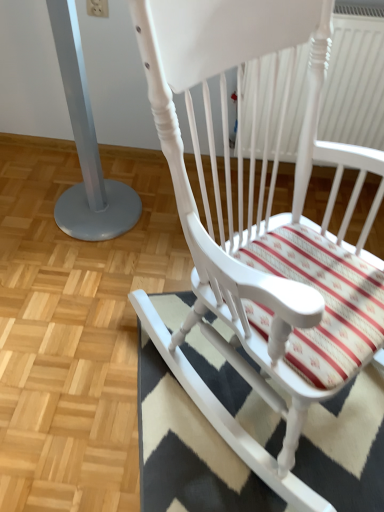
Question: From the image's perspective, is black-and-white striped rug at lower right on top of white painted wood rocking chair at center?

Choices:
 (A) yes
 (B) no

Answer: (B)

Question: From a real-world perspective, is black-and-white striped rug at lower right physically below white painted wood rocking chair at center?

Choices:
 (A) no
 (B) yes

Answer: (B)

Question: Considering the relative sizes of black-and-white striped rug at lower right and white painted wood rocking chair at center in the image provided, is black-and-white striped rug at lower right shorter than white painted wood rocking chair at center?

Choices:
 (A) no
 (B) yes

Answer: (B)

Question: Is black-and-white striped rug at lower right facing away from white painted wood rocking chair at center?

Choices:
 (A) yes
 (B) no

Answer: (B)

Question: Can you confirm if black-and-white striped rug at lower right is positioned to the left of white painted wood rocking chair at center?

Choices:
 (A) no
 (B) yes

Answer: (A)

Question: Is silver metallic pole at left inside the boundaries of white plastic radiator at upper right, or outside?

Choices:
 (A) inside
 (B) outside

Answer: (B)

Question: From a real-world perspective, is silver metallic pole at left physically located above or below white plastic radiator at upper right?

Choices:
 (A) below
 (B) above

Answer: (A)

Question: From their relative heights in the image, would you say silver metallic pole at left is taller or shorter than white plastic radiator at upper right?

Choices:
 (A) tall
 (B) short

Answer: (A)

Question: Considering the positions of silver metallic pole at left and white plastic radiator at upper right in the image, is silver metallic pole at left wider or thinner than white plastic radiator at upper right?

Choices:
 (A) wide
 (B) thin

Answer: (A)

Question: From a real-world perspective, is black-and-white striped rug at lower right positioned above or below white plastic radiator at upper right?

Choices:
 (A) below
 (B) above

Answer: (A)

Question: Considering their positions, is black-and-white striped rug at lower right located in front of or behind white plastic radiator at upper right?

Choices:
 (A) front
 (B) behind

Answer: (A)

Question: Is black-and-white striped rug at lower right taller or shorter than white plastic radiator at upper right?

Choices:
 (A) short
 (B) tall

Answer: (A)

Question: Is black-and-white striped rug at lower right bigger or smaller than white plastic radiator at upper right?

Choices:
 (A) big
 (B) small

Answer: (B)

Question: Is white plastic radiator at upper right taller or shorter than white painted wood rocking chair at center?

Choices:
 (A) short
 (B) tall

Answer: (A)

Question: Is white plastic radiator at upper right situated inside white painted wood rocking chair at center or outside?

Choices:
 (A) inside
 (B) outside

Answer: (B)